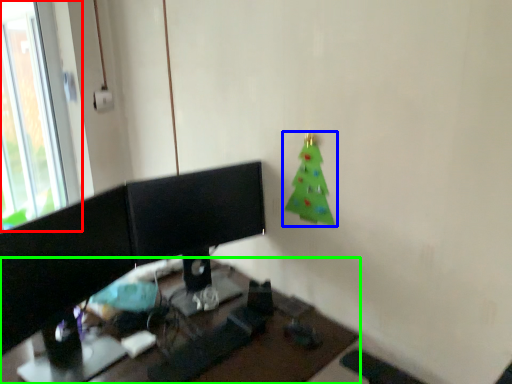
Question: Estimate the real-world distances between objects in this image. Which object is farther from window (highlighted by a red box), christmas tree (highlighted by a blue box) or desk (highlighted by a green box)?

Choices:
 (A) christmas tree
 (B) desk

Answer: (A)